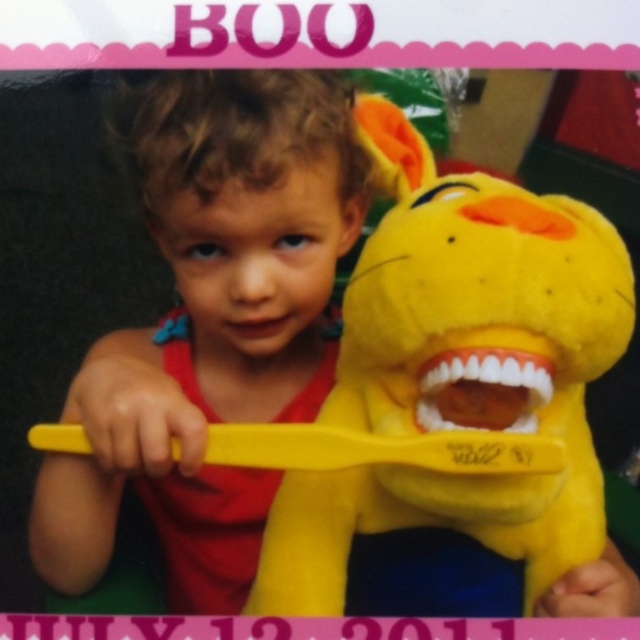
Question: Is the position of yellow plush toy at center more distant than that of yellow plastic toothbrush at center?

Choices:
 (A) no
 (B) yes

Answer: (A)

Question: Which object is positioned farthest from the matte yellow toothbrush at center?

Choices:
 (A) pink matte mouth at center
 (B) white matte teeth at center
 (C) yellow plush toy at center
 (D) yellow plastic toothbrush at center

Answer: (B)

Question: Does matte yellow toothbrush at center lie in front of pink matte mouth at center?

Choices:
 (A) yes
 (B) no

Answer: (A)

Question: Among these points, which one is farthest from the camera?

Choices:
 (A) (461, 420)
 (B) (390, 440)
 (C) (262, 595)
 (D) (243, 220)

Answer: (D)

Question: Is yellow plush toy at center smaller than white matte teeth at center?

Choices:
 (A) yes
 (B) no

Answer: (B)

Question: Which object is closer to the camera taking this photo?

Choices:
 (A) matte yellow toothbrush at center
 (B) yellow plastic toothbrush at center

Answer: (B)